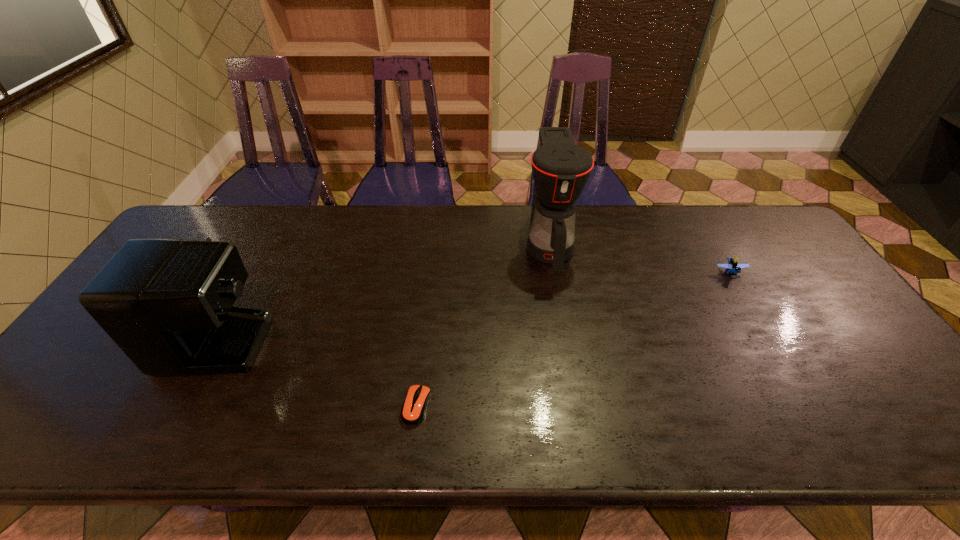
You are a GUI agent. You are given a task and a screenshot of the screen. Output one action in this format:
    pyautogui.click(x=<x>, y=<y>)
    Task: Click on the vacant area situated on the front-facing side of the second shortest object
    Image resolution: width=960 pixels, height=540 pixels.
    Given the screenshot: What is the action you would take?
    pyautogui.click(x=800, y=389)

Image resolution: width=960 pixels, height=540 pixels. I want to click on vacant space positioned 0.080m on the left of the nearest object, so click(x=368, y=406).

The width and height of the screenshot is (960, 540). Find the location of `object that is at the near edge`. object that is at the near edge is located at coordinates coord(413,409).

At what (x,y) coordinates should I click in order to perform the action: click on object that is at the left edge. Please return your answer as a coordinate pair (x, y). Looking at the image, I should click on click(167, 303).

Where is `object that is at the far left corner`? The width and height of the screenshot is (960, 540). object that is at the far left corner is located at coordinates (167, 303).

What are the coordinates of `free space at the far edge of the desktop` in the screenshot? It's located at (713, 220).

The width and height of the screenshot is (960, 540). In the image, there is a desktop. Identify the location of vacant space at the near edge. (681, 429).

This screenshot has width=960, height=540. In the image, there is a desktop. In order to click on free space at the left edge in this screenshot , I will do `click(59, 395)`.

In the image, there is a desktop. Identify the location of vacant space at the right edge. The height and width of the screenshot is (540, 960). (862, 391).

The width and height of the screenshot is (960, 540). Find the location of `empty space that is in between the Lego and the third object from left to right`. empty space that is in between the Lego and the third object from left to right is located at coordinates (639, 259).